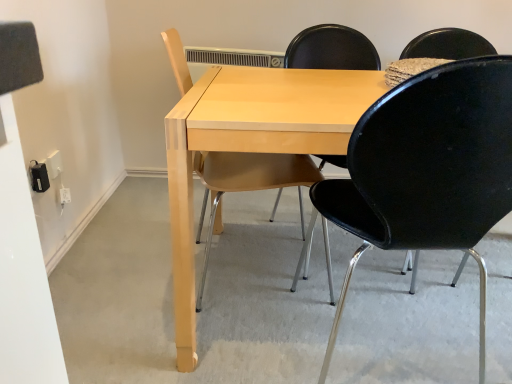
Question: From a real-world perspective, relative to light wood table at center, is black plastic chair at center, which is counted as the first chair, starting from the right, vertically above or below?

Choices:
 (A) above
 (B) below

Answer: (A)

Question: Would you say black plastic chair at center, which is counted as the first chair, starting from the right, is inside or outside light wood table at center?

Choices:
 (A) inside
 (B) outside

Answer: (A)

Question: Which of these objects is positioned closest to the light wood table at center?

Choices:
 (A) light wood chair at center, the 2th chair positioned from the right
 (B) black plastic chair at center, positioned as the 2th chair in left-to-right order

Answer: (A)

Question: Considering the real-world distances, which object is closest to the light wood table at center?

Choices:
 (A) black plastic chair at center, positioned as the 2th chair in left-to-right order
 (B) light wood chair at center, the 2th chair positioned from the right

Answer: (B)